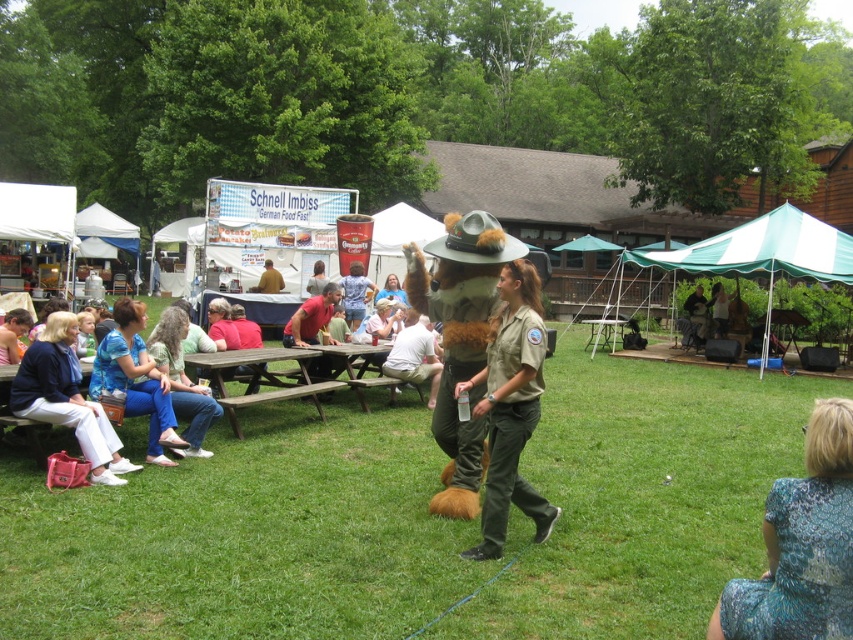
You are a photographer trying to capture the entire scene of the outdoor event. You notice the green grass at center and the green fabric canopy at upper right. Which object should you focus on first to ensure both are in frame?

You should focus on the green grass at center first since it is positioned to the left of the green fabric canopy at upper right, ensuring both are captured in the frame.

From the picture: You are a photographer at the event and need to capture both the blue denim jeans at left and the brown wooden picnic table at center in one frame. Which object should you focus on first to ensure both are in the frame?

You should focus on the brown wooden picnic table at center first because it is larger than the blue denim jeans at left, ensuring it fits properly in the frame while still capturing the smaller object.

Based on the photo, you are a photographer at the event and want to take a photo of the blue denim jeans at left and the brown wooden picnic table at center so that both are fully visible. Based on their positions, which object should you focus on first to ensure both are in frame?

The blue denim jeans at left is in front of the brown wooden picnic table at center, so you should focus on the brown wooden picnic table at center first to ensure both are in frame.